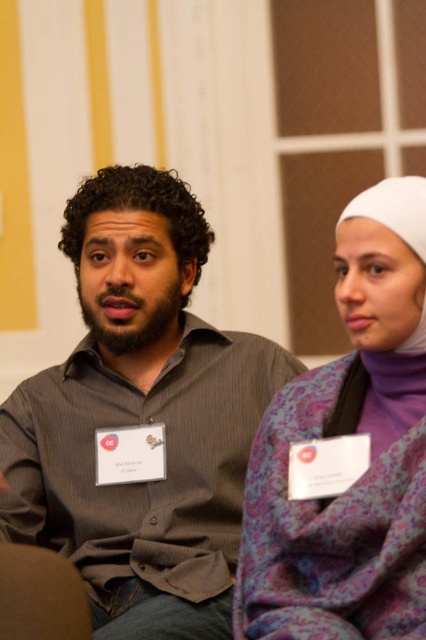
This screenshot has width=426, height=640. Describe the element at coordinates (141, 417) in the screenshot. I see `gray shirt at center` at that location.

The height and width of the screenshot is (640, 426). What are the coordinates of `gray shirt at center` in the screenshot? It's located at (141, 417).

This screenshot has width=426, height=640. I want to click on gray shirt at center, so click(141, 417).

Is gray shirt at center positioned before white fabric headscarf at upper right?

No.

Is gray shirt at center smaller than white fabric headscarf at upper right?

No, gray shirt at center is not smaller than white fabric headscarf at upper right.

Identify the location of gray shirt at center. This screenshot has height=640, width=426. (141, 417).

At what (x,y) coordinates should I click in order to perform the action: click on gray shirt at center. Please return your answer as a coordinate pair (x, y). Looking at the image, I should click on (141, 417).

Looking at this image, is purple paisley scarf at center thinner than white fabric headscarf at upper right?

No, purple paisley scarf at center is not thinner than white fabric headscarf at upper right.

Does point (393, 598) lie behind point (405, 196)?

That is False.

Locate an element on the screen. purple paisley scarf at center is located at coordinates (348, 451).